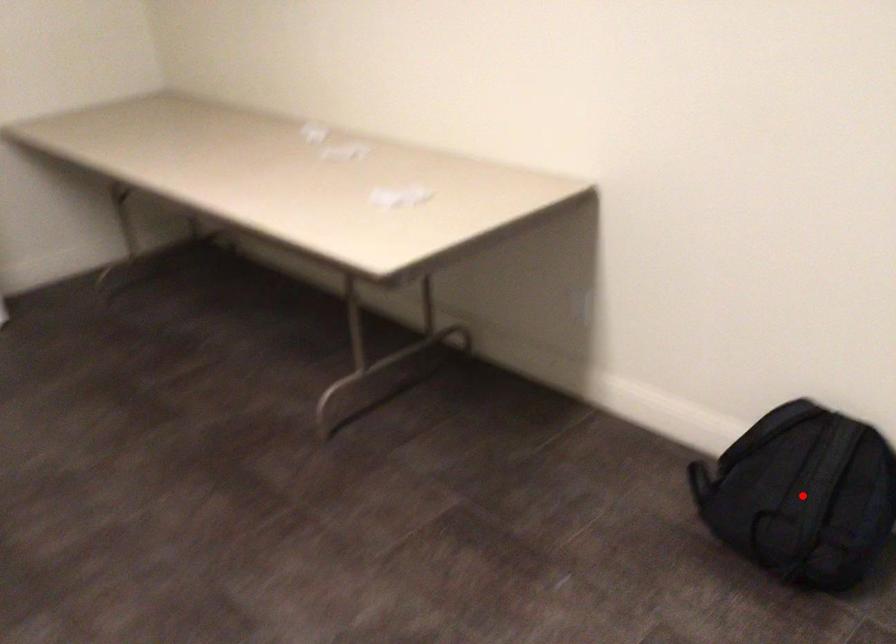
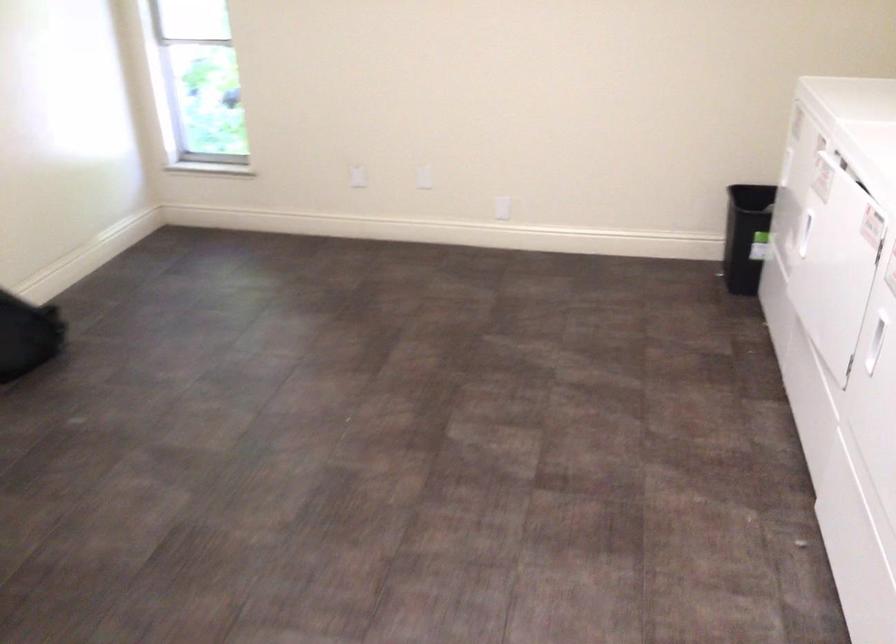
Question: I am providing you with two images of the same scene from different viewpoints. A red point is marked on the first image. At the location where the point appears in image 1, is it still visible in image 2?

Choices:
 (A) Yes
 (B) No

Answer: (B)